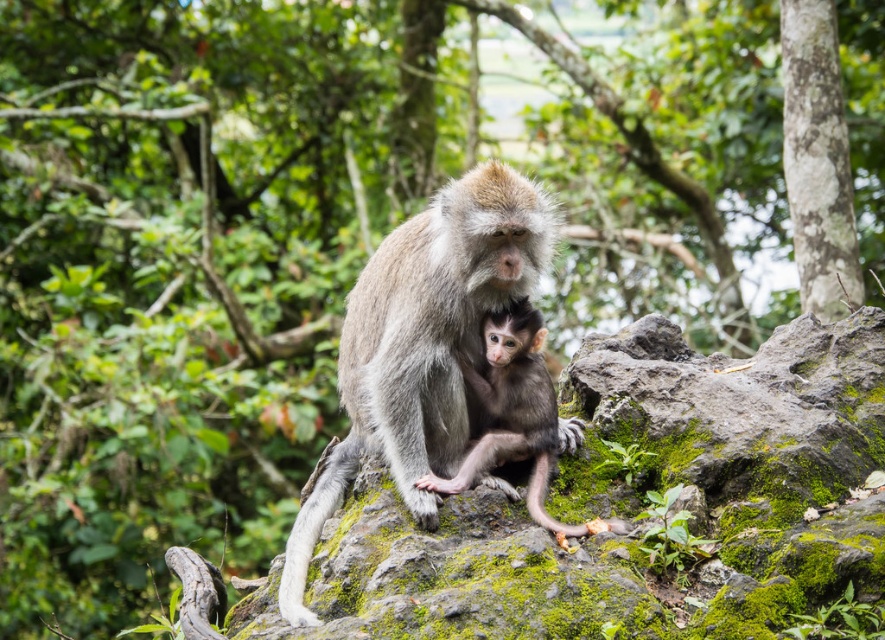
Question: Does green mossy rock at center have a lesser width compared to gray furry monkey at center?

Choices:
 (A) no
 (B) yes

Answer: (A)

Question: Which is farther from the gray fur monkey at center?

Choices:
 (A) green mossy rock at center
 (B) gray furry monkey at center

Answer: (A)

Question: Observing the image, what is the correct spatial positioning of green mossy rock at center in reference to gray fur monkey at center?

Choices:
 (A) above
 (B) below

Answer: (B)

Question: Which of the following is the farthest from the observer?

Choices:
 (A) gray furry monkey at center
 (B) green mossy rock at center
 (C) gray fur monkey at center

Answer: (A)

Question: Which point is farther to the camera?

Choices:
 (A) (283, 588)
 (B) (683, 500)

Answer: (A)

Question: Can you confirm if gray fur monkey at center is positioned to the left of gray furry monkey at center?

Choices:
 (A) yes
 (B) no

Answer: (A)